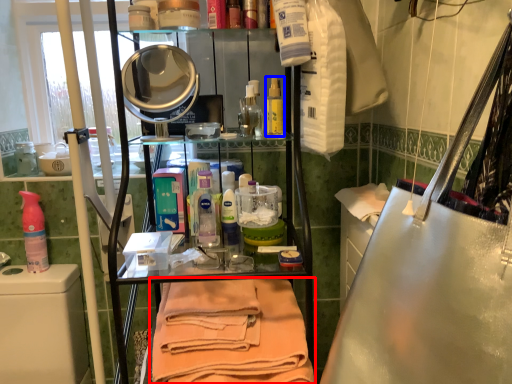
Question: Among these objects, which one is farthest to the camera, towel (highlighted by a red box) or mouthwash (highlighted by a blue box)?

Choices:
 (A) towel
 (B) mouthwash

Answer: (B)